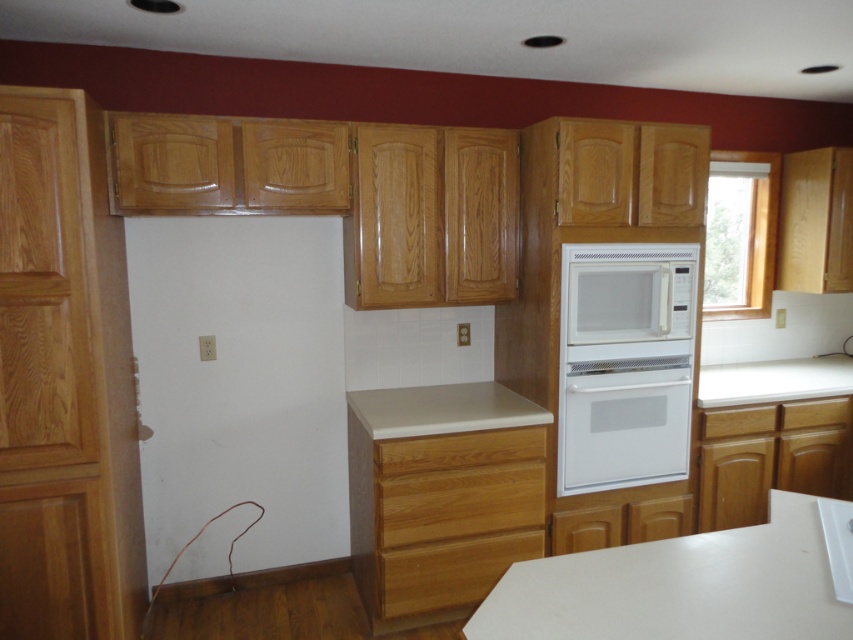
Does white laminate counter top at lower center appear on the left side of wooden drawer at lower center?

No, white laminate counter top at lower center is not to the left of wooden drawer at lower center.

Does white laminate counter top at lower center appear under wooden drawer at lower center?

Incorrect, white laminate counter top at lower center is not positioned below wooden drawer at lower center.

In order to click on white laminate counter top at lower center in this screenshot , I will do `click(677, 588)`.

Where is `white laminate counter top at lower center`? The image size is (853, 640). white laminate counter top at lower center is located at coordinates (677, 588).

Identify the location of white laminate counter top at right. The image size is (853, 640). (775, 380).

Who is taller, white laminate counter top at right or wooden drawer at lower right?

Standing taller between the two is white laminate counter top at right.

The height and width of the screenshot is (640, 853). What are the coordinates of `white laminate counter top at right` in the screenshot? It's located at (775, 380).

Between point (663, 276) and point (662, 308), which one is positioned in front?

Point (663, 276) is in front.

Can you confirm if white glossy oven at center is positioned above white matte microwave at center?

Incorrect, white glossy oven at center is not positioned above white matte microwave at center.

Identify the location of white glossy oven at center. 624,364.